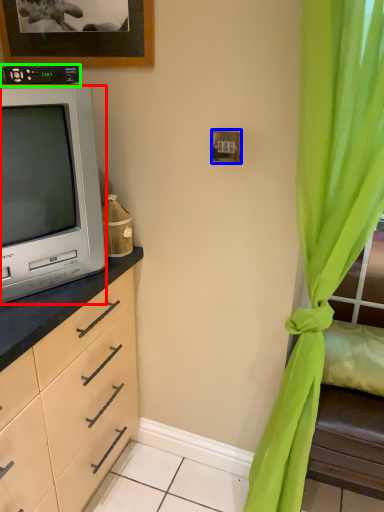
Question: Which object is the closest to the television (highlighted by a red box)? Choose among these: electric outlet (highlighted by a blue box) or appliance (highlighted by a green box).

Choices:
 (A) electric outlet
 (B) appliance

Answer: (B)